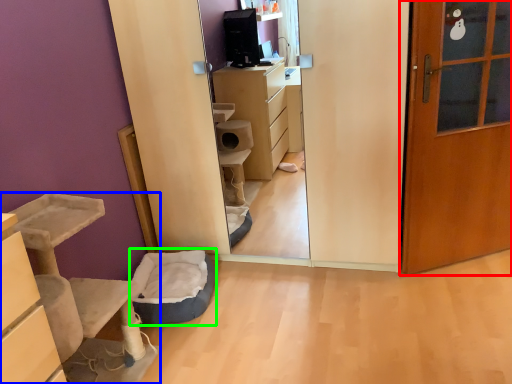
Question: Based on their relative distances, which object is farther from door (highlighted by a red box)? Choose from furniture (highlighted by a blue box) and infant bed (highlighted by a green box).

Choices:
 (A) furniture
 (B) infant bed

Answer: (A)